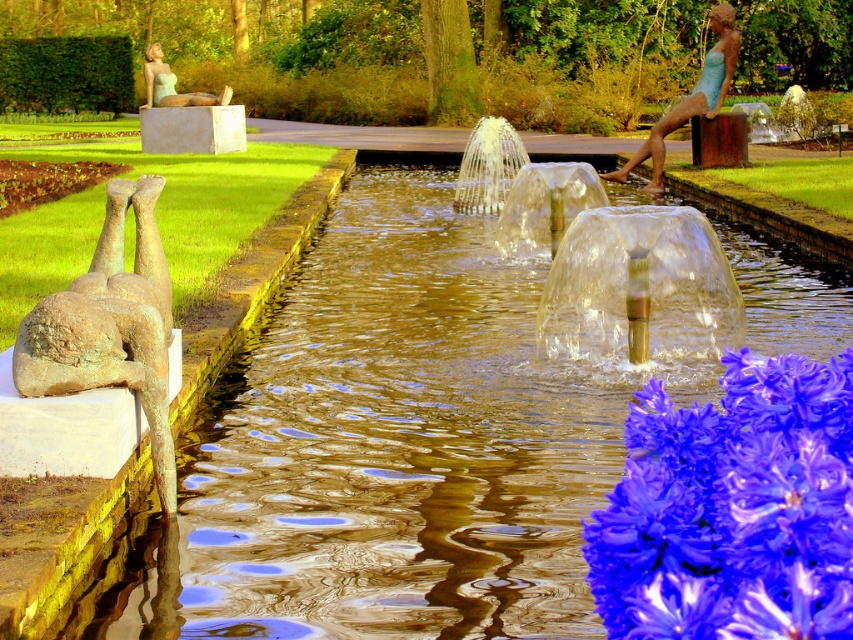
Is point (809, 570) closer to viewer compared to point (164, 97)?

Yes, point (809, 570) is closer to viewer.

Can you confirm if blue glossy flower at center is wider than matte green statue at upper left?

No, blue glossy flower at center is not wider than matte green statue at upper left.

At what (x,y) coordinates should I click in order to perform the action: click on blue glossy flower at center. Please return your answer as a coordinate pair (x, y). Image resolution: width=853 pixels, height=640 pixels. Looking at the image, I should click on (732, 509).

Who is lower down, green marble statue at upper left or matte green statue at upper left?

green marble statue at upper left is lower down.

Does green marble statue at upper left appear under matte green statue at upper left?

Indeed, green marble statue at upper left is positioned under matte green statue at upper left.

Image resolution: width=853 pixels, height=640 pixels. What do you see at coordinates (186, 115) in the screenshot?
I see `green marble statue at upper left` at bounding box center [186, 115].

Locate an element on the screen. green marble statue at upper left is located at coordinates (186, 115).

Who is taller, bronze statue at left or bronze statue at center?

Standing taller between the two is bronze statue at center.

Does bronze statue at left have a lesser height compared to bronze statue at center?

Correct, bronze statue at left is not as tall as bronze statue at center.

Identify the location of bronze statue at left. (109, 324).

At what (x,y) coordinates should I click in order to perform the action: click on bronze statue at left. Please return your answer as a coordinate pair (x, y). This screenshot has width=853, height=640. Looking at the image, I should click on (109, 324).